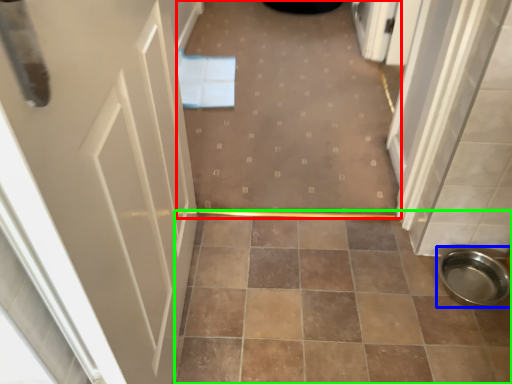
Question: Which object is the farthest from plain (highlighted by a red box)? Choose among these: toilet bowl (highlighted by a blue box) or ceramic tile (highlighted by a green box).

Choices:
 (A) toilet bowl
 (B) ceramic tile

Answer: (A)